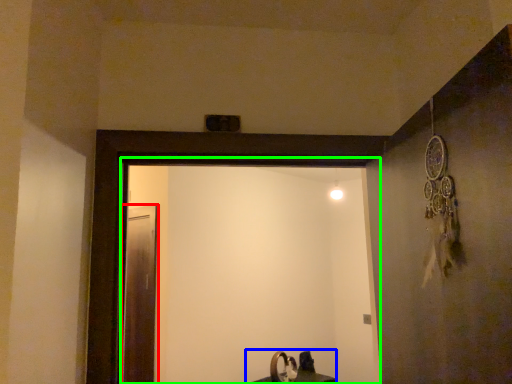
Question: Considering the real-world distances, which object is farthest from screen door (highlighted by a red box)? sink (highlighted by a blue box) or screen door (highlighted by a green box)?

Choices:
 (A) sink
 (B) screen door

Answer: (A)